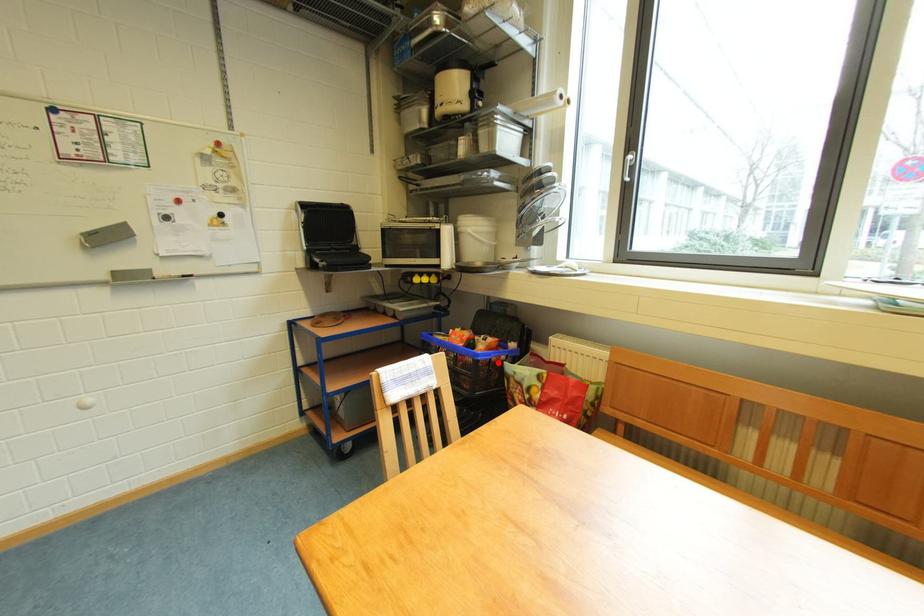
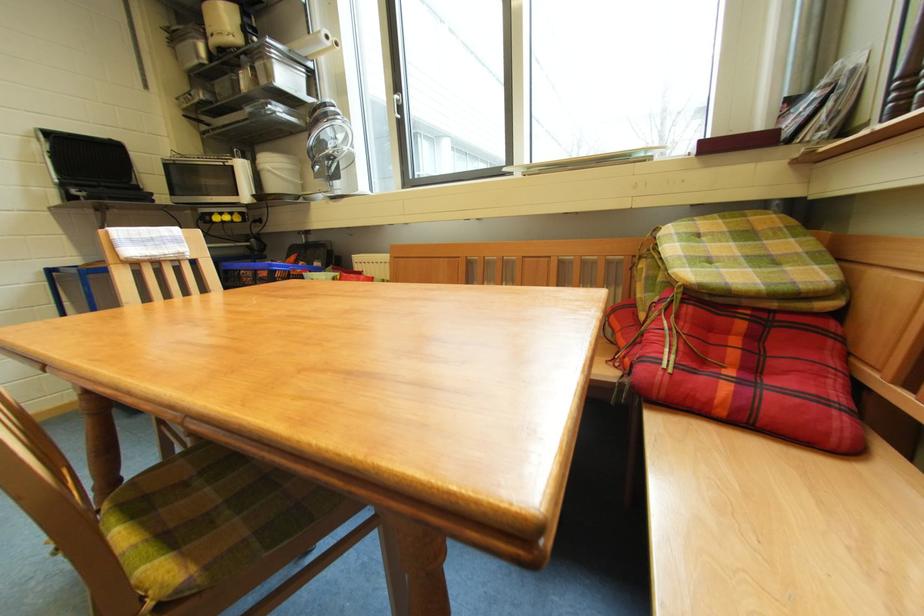
Where in the second image is the point corresponding to the highlighted location from the first image?

(296, 274)